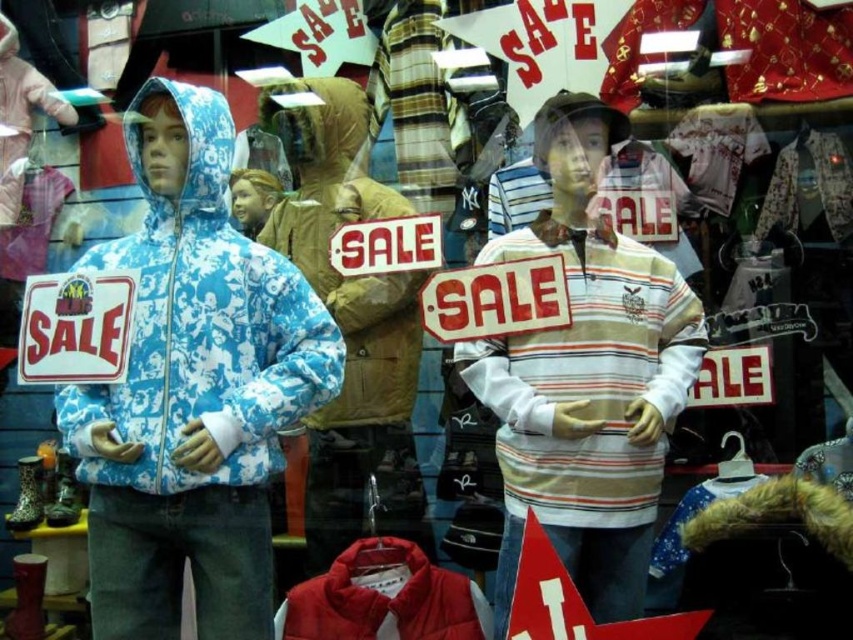
Looking at this image, you are a customer looking at the retail display window. You see the blue printed jacket at left and the brown fuzzy jacket at center. Which jacket is closer to you?

The blue printed jacket at left is closer to you because it is in front of the brown fuzzy jacket at center.

You are a customer looking at the display window. You see the striped cotton shirt at center and the red down jacket at lower center. Which item is positioned higher in the window?

The striped cotton shirt at center is taller than the red down jacket at lower center, so the striped cotton shirt at center is positioned higher in the window.